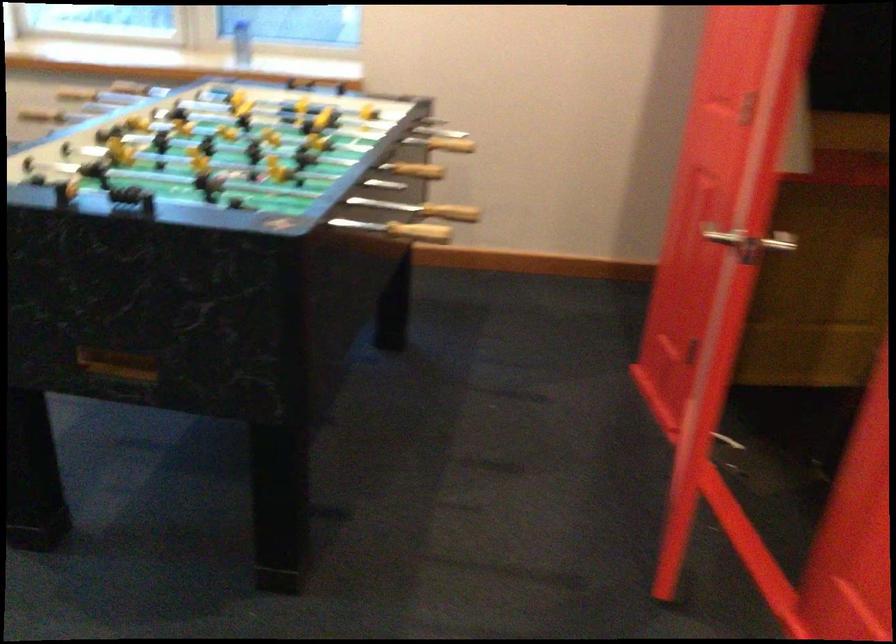
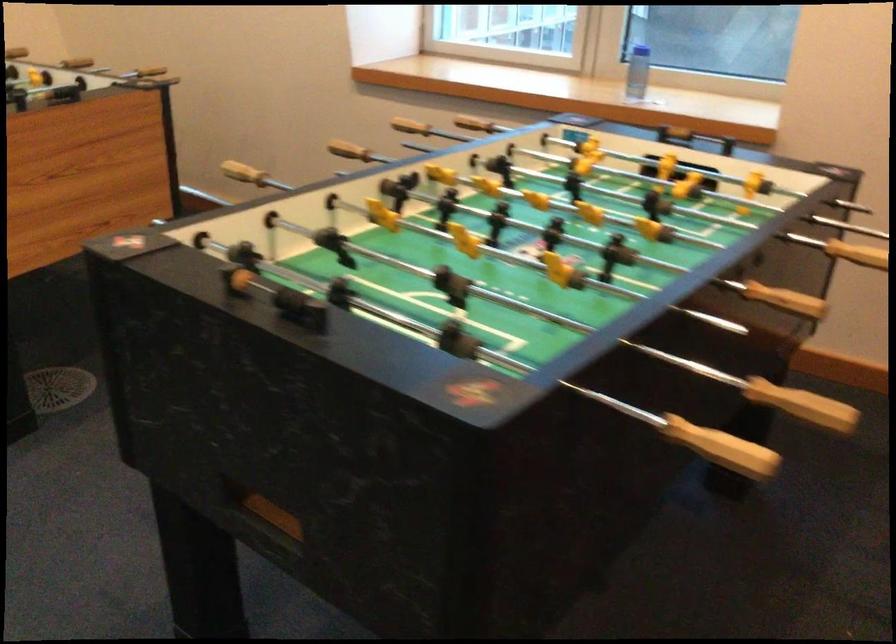
Question: The images are taken continuously from a first-person perspective. In which direction is your viewpoint rotating?

Choices:
 (A) Left
 (B) Right
 (C) Up
 (D) Down

Answer: (A)